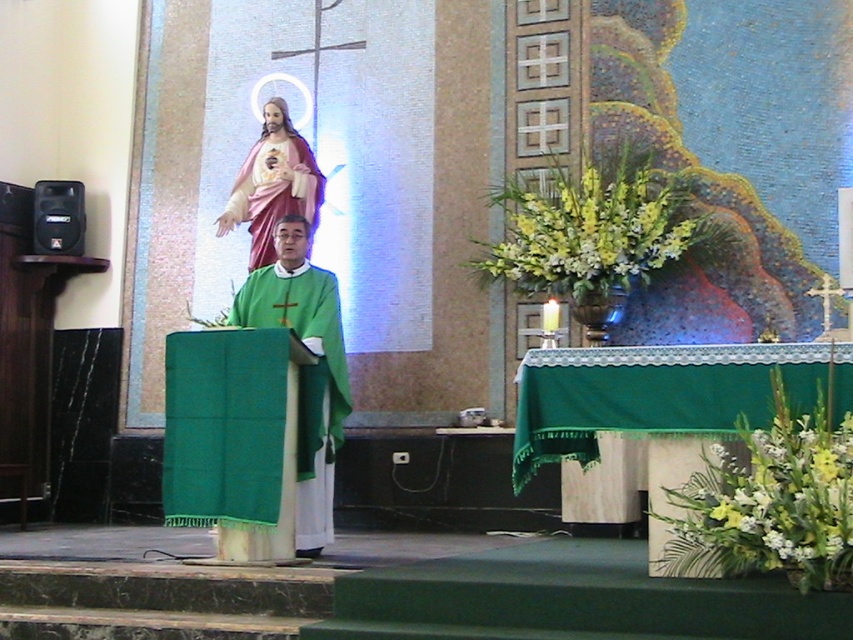
Describe the element at coordinates (311, 352) in the screenshot. I see `green clothed priest at center` at that location.

Looking at this image, does green clothed priest at center have a lesser width compared to matte pink fabric statue at upper center?

Indeed, green clothed priest at center has a lesser width compared to matte pink fabric statue at upper center.

I want to click on green clothed priest at center, so click(x=311, y=352).